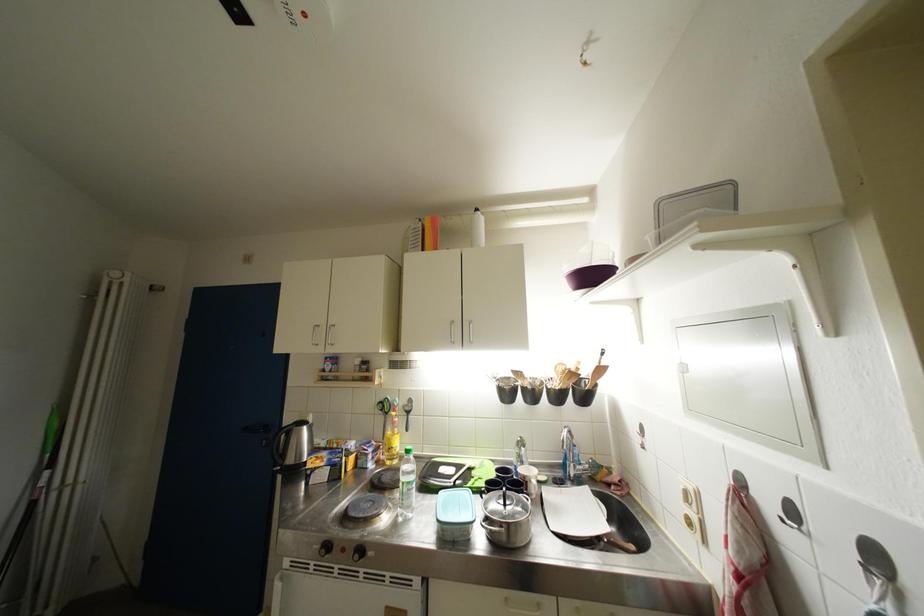
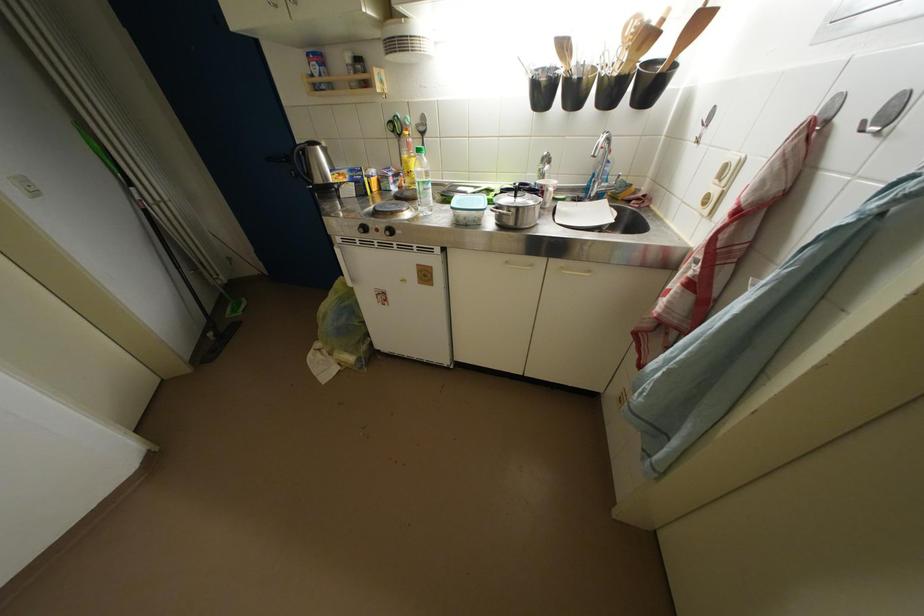
Find the pixel in the second image that matches the point at 351,549 in the first image.

(383, 230)